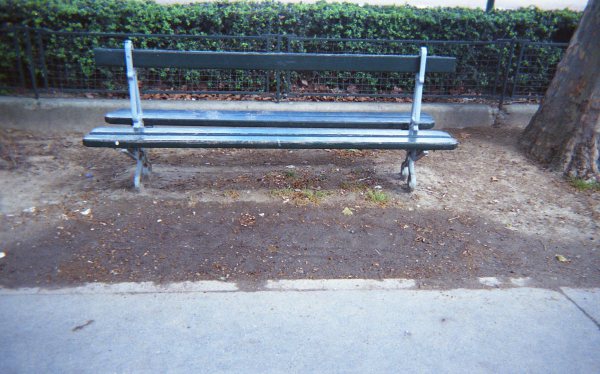
I want to click on bench, so click(278, 138).